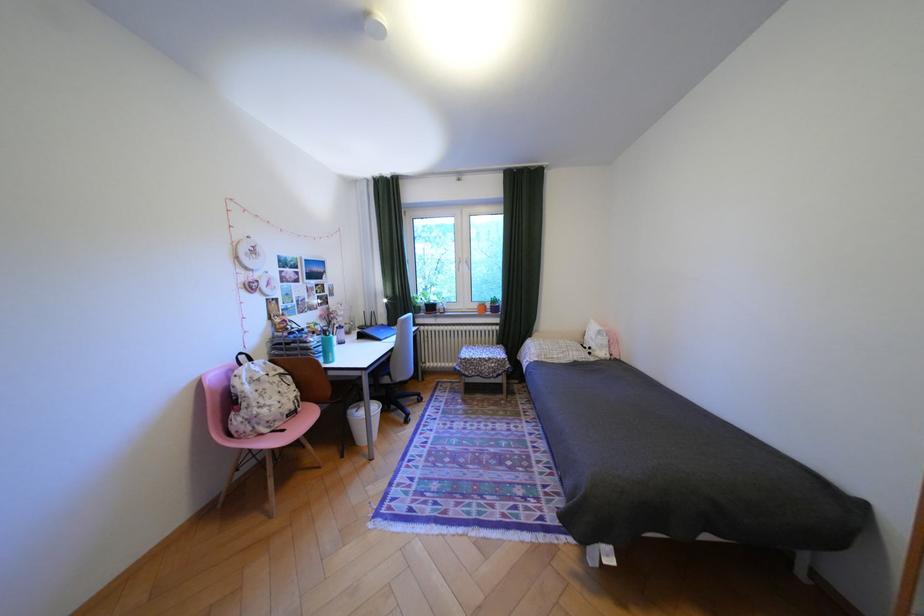
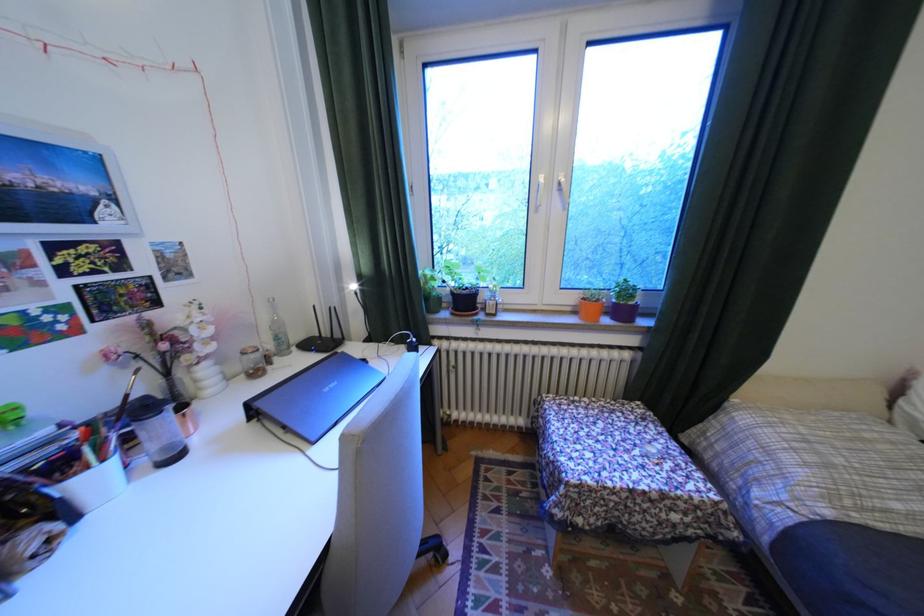
In the second image, find the point that corresponds to point (346, 339) in the first image.

(106, 479)